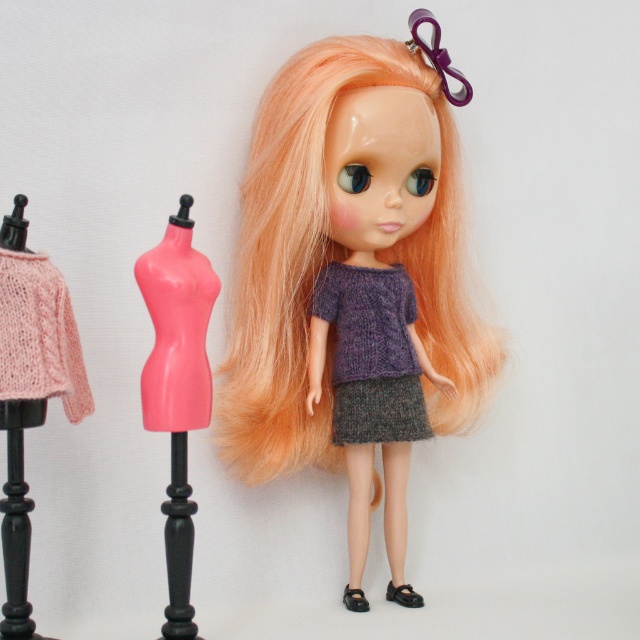
You are a tailor working in a store. You need to place a new dress on the taller object between the blonde silky hair at center and the pink plastic dress form at left. Which object should you choose?

The blonde silky hair at center is much taller than the pink plastic dress form at left, so you should choose the blonde silky hair at center to place the new dress.